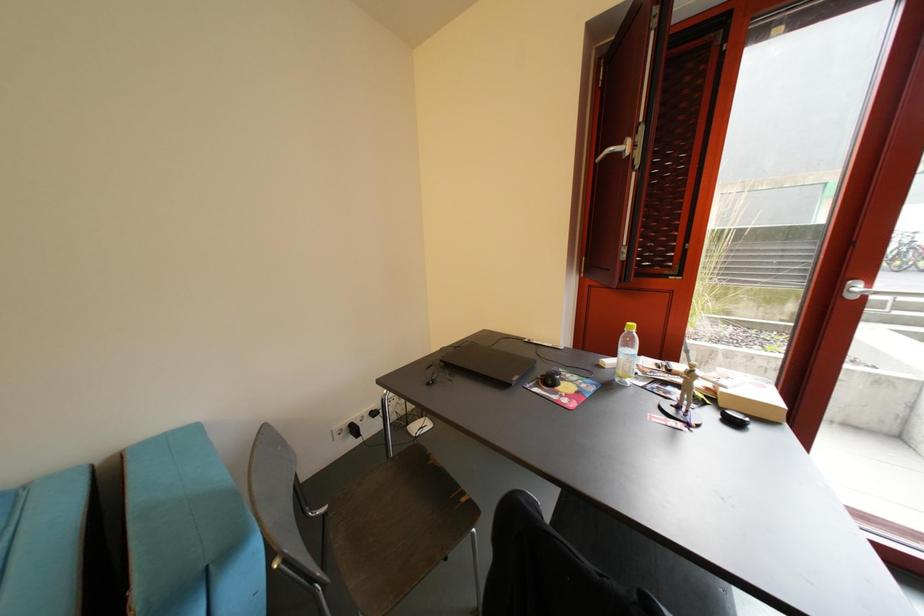
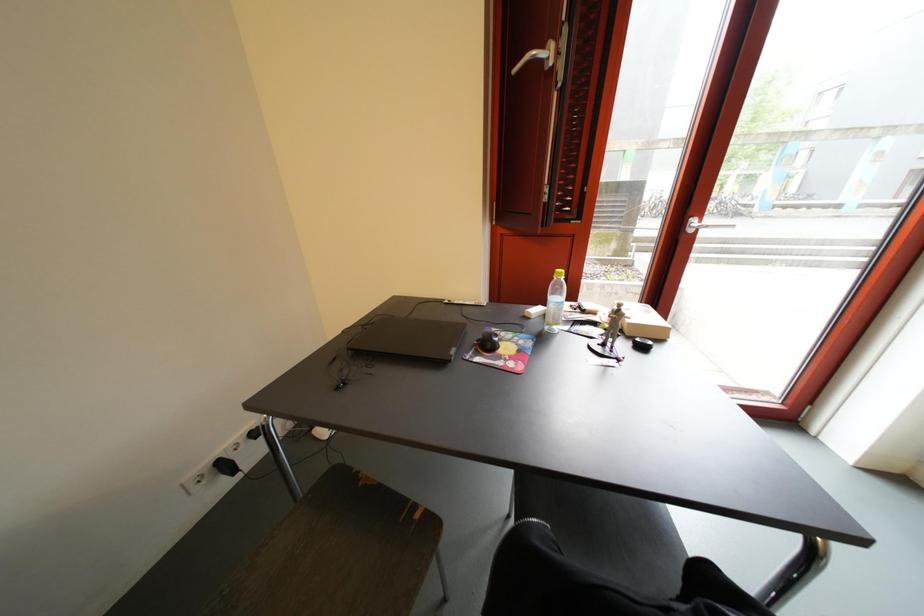
Question: In a continuous first-person perspective shot, in which direction is the camera moving?

Choices:
 (A) Left
 (B) Right
 (C) Forward
 (D) Backward

Answer: (C)